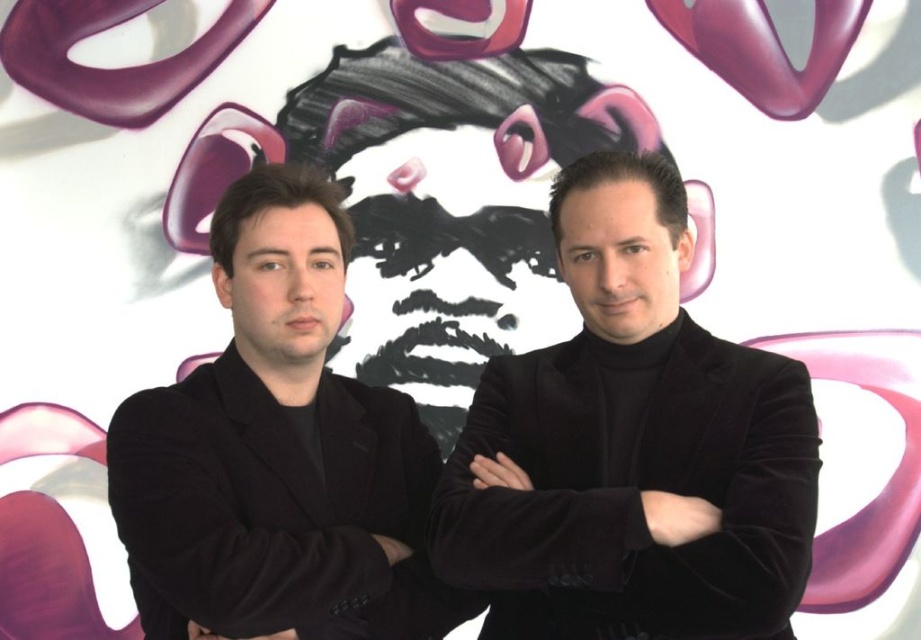
You are a photographer setting up for a portrait. You need to ensure that the velvet black suit at center and the black velvet arm at left are clearly visible in the frame. Given that your camera has a minimum focus distance of 12 inches, will both subjects be in focus?

The distance between the velvet black suit at center and the black velvet arm at left is 12.93 inches, which is just above the camera minimum focus distance of 12 inches. Therefore, both subjects will be in focus.

You are a photographer setting up a shoot. You need to ensure that the velvet black suit at center and the black velvet arm at left are both visible in the frame. Based on their positions, which one should you focus on first to ensure it is fully captured?

The velvet black suit at center should be focused on first because it is in front of the black velvet arm at left, ensuring it stays in the foreground and fully visible.

You are a photographer setting up for a formal event. You notice two identical black suits in the center of the image. One is labeled as the velvet black suit at center, and the other is the black velvet suit at center. According to the scene description, which one is positioned to the right?

The velvet black suit at center is positioned to the right of the black velvet suit at center.